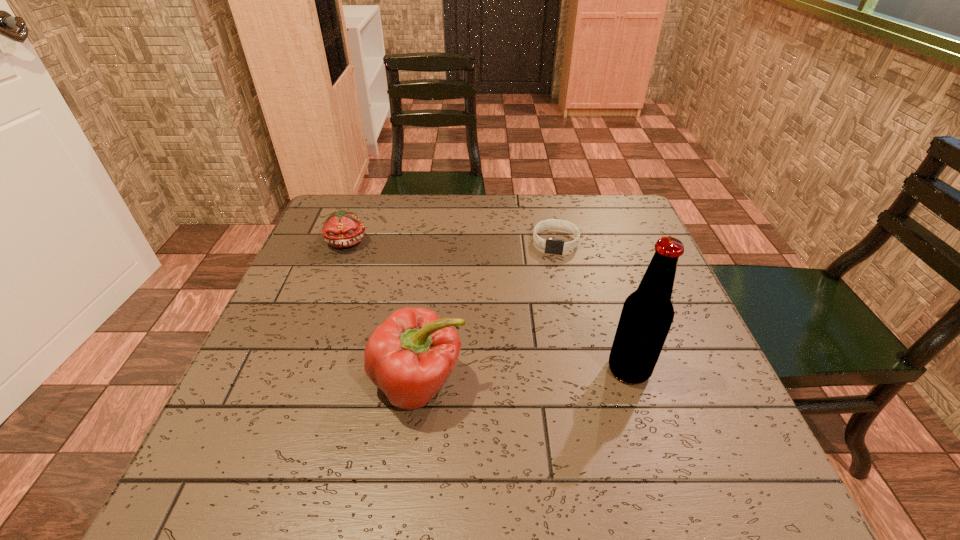
Image resolution: width=960 pixels, height=540 pixels. Identify the location of free point between the third object from right to left and the wristband. pyautogui.click(x=488, y=313).

Image resolution: width=960 pixels, height=540 pixels. Find the location of `vacant area between the second tallest object and the tallest object`. vacant area between the second tallest object and the tallest object is located at coordinates (524, 376).

The image size is (960, 540). I want to click on vacant area between the tallest object and the shortest object, so click(x=592, y=305).

Locate an element on the screen. This screenshot has height=540, width=960. unoccupied area between the third tallest object and the second object from left to right is located at coordinates (383, 313).

Where is `vacant point located between the shortest object and the tallest object`? vacant point located between the shortest object and the tallest object is located at coordinates (592, 305).

Locate which object ranks third in proximity to the tallest object. Please provide its 2D coordinates. Your answer should be formatted as a tuple, i.e. [(x, y)], where the tuple contains the x and y coordinates of a point satisfying the conditions above.

[(341, 229)]

The image size is (960, 540). In order to click on object that can be found as the second closest to the second shortest object in this screenshot , I will do `click(551, 245)`.